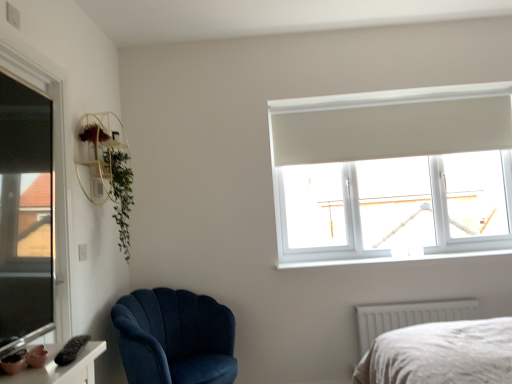
Locate an element on the screen. vacant space situated above white textured radiator at lower right (from a real-world perspective) is located at coordinates (422, 298).